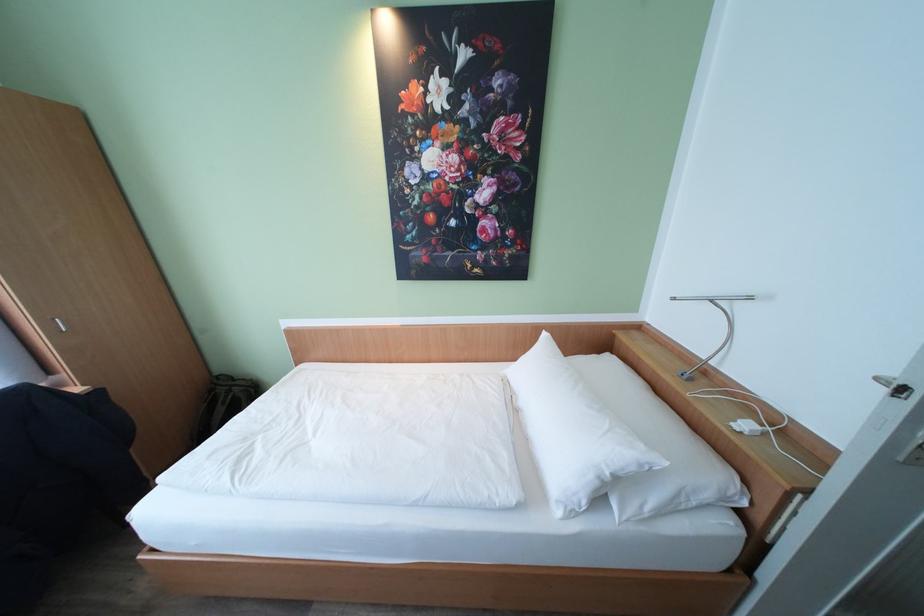
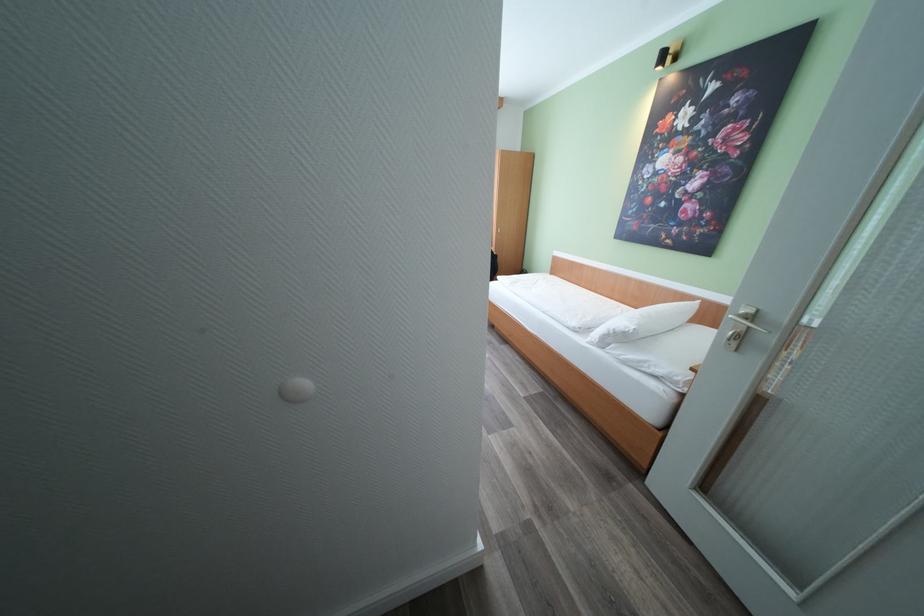
Question: I am providing you with two images of the same scene from different viewpoints. Which of the following objects are not visible in image2?

Choices:
 (A) brown leather purse
 (B) white pillow
 (C) silver door handle
 (D) dark green backpack

Answer: (D)